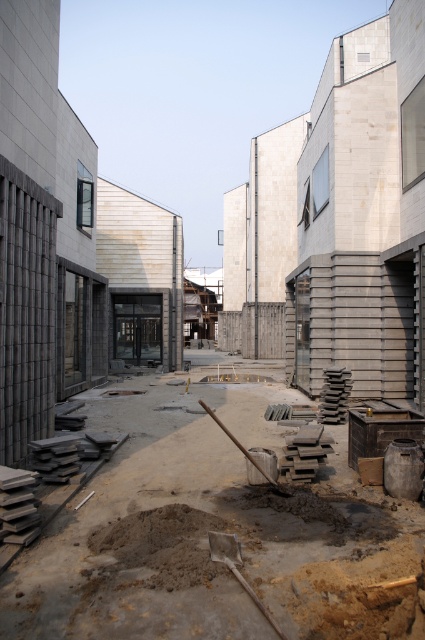
Question: Which of the following is the farthest from the observer?

Choices:
 (A) brown concrete at center
 (B) metallic silver shovel at center
 (C) wooden shovel at center

Answer: (C)

Question: Is brown concrete at center thinner than metallic silver shovel at center?

Choices:
 (A) yes
 (B) no

Answer: (B)

Question: Considering the relative positions of brown concrete at center and metallic silver shovel at center in the image provided, where is brown concrete at center located with respect to metallic silver shovel at center?

Choices:
 (A) above
 (B) below

Answer: (B)

Question: Which of the following is the farthest from the observer?

Choices:
 (A) metallic silver shovel at center
 (B) wooden shovel at center
 (C) brown concrete at center

Answer: (B)

Question: Does metallic silver shovel at center appear on the left side of wooden shovel at center?

Choices:
 (A) no
 (B) yes

Answer: (A)

Question: Based on their relative distances, which object is nearer to the metallic silver shovel at center?

Choices:
 (A) wooden shovel at center
 (B) brown concrete at center

Answer: (A)